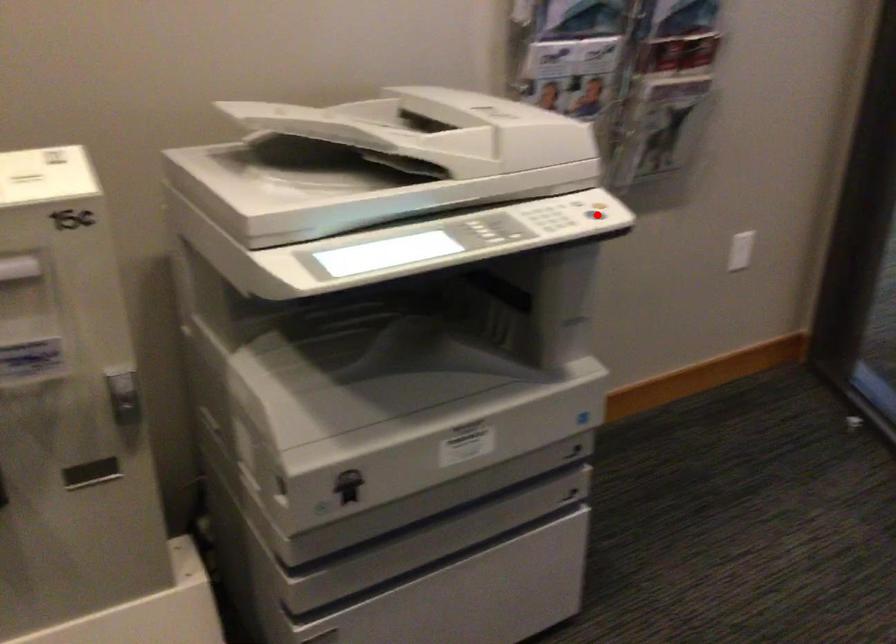
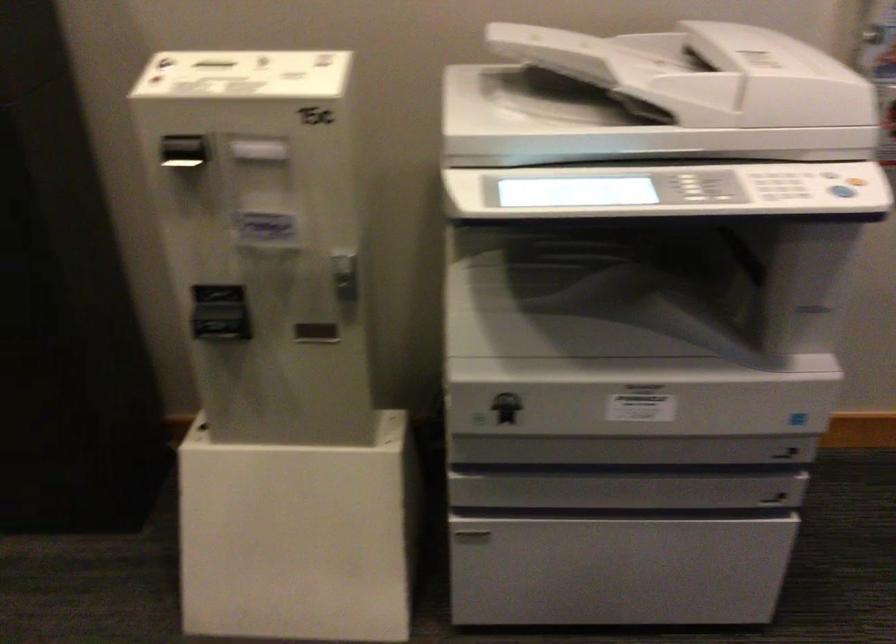
Question: I am providing you with two images of the same scene from different viewpoints. Image1 has a red point marked. In image2, the corresponding 3D location appears at what relative position? Reply with the corresponding letter.

Choices:
 (A) Closer
 (B) Farther

Answer: (A)